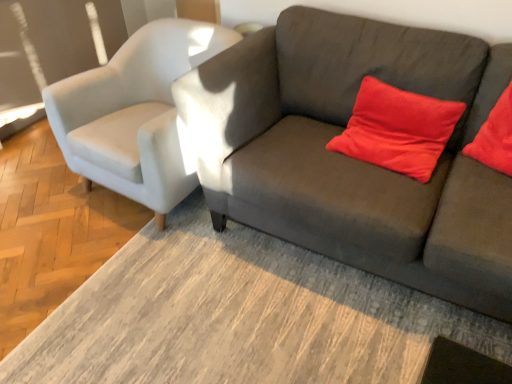
Question: Can dark gray fabric couch at center be found inside satin red pillow at upper right?

Choices:
 (A) no
 (B) yes

Answer: (A)

Question: Is satin red pillow at upper right taller than dark gray fabric couch at center?

Choices:
 (A) yes
 (B) no

Answer: (B)

Question: From a real-world perspective, is satin red pillow at upper right on top of dark gray fabric couch at center?

Choices:
 (A) no
 (B) yes

Answer: (B)

Question: Is satin red pillow at upper right turned away from dark gray fabric couch at center?

Choices:
 (A) yes
 (B) no

Answer: (A)

Question: Can you confirm if satin red pillow at upper right is bigger than dark gray fabric couch at center?

Choices:
 (A) no
 (B) yes

Answer: (A)

Question: Does satin red pillow at upper right come in front of dark gray fabric couch at center?

Choices:
 (A) yes
 (B) no

Answer: (B)

Question: Does dark gray fabric couch at center come behind satin red pillow at upper right?

Choices:
 (A) no
 (B) yes

Answer: (A)

Question: Considering the relative sizes of dark gray fabric couch at center and satin red pillow at upper right in the image provided, is dark gray fabric couch at center shorter than satin red pillow at upper right?

Choices:
 (A) no
 (B) yes

Answer: (A)

Question: Considering the relative sizes of dark gray fabric couch at center and satin red pillow at upper right in the image provided, is dark gray fabric couch at center bigger than satin red pillow at upper right?

Choices:
 (A) no
 (B) yes

Answer: (B)

Question: Is dark gray fabric couch at center looking in the opposite direction of satin red pillow at upper right?

Choices:
 (A) no
 (B) yes

Answer: (B)

Question: Is dark gray fabric couch at center at the left side of satin red pillow at upper right?

Choices:
 (A) yes
 (B) no

Answer: (A)

Question: Is dark gray fabric couch at center positioned beyond the bounds of satin red pillow at upper right?

Choices:
 (A) yes
 (B) no

Answer: (A)

Question: Is satin red pillow at upper right further to the viewer compared to satin white armchair at left?

Choices:
 (A) yes
 (B) no

Answer: (B)